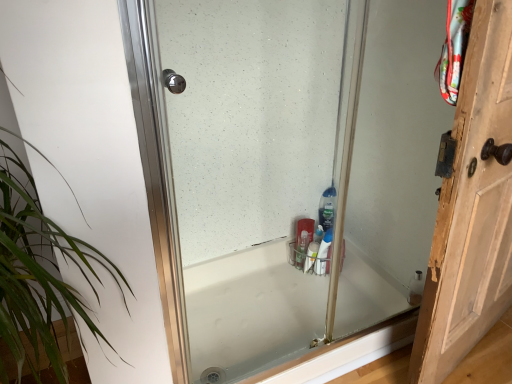
Where is `blank space to the left of white glossy bottle at lower right, the 2th cleaning product positioned from the top`? blank space to the left of white glossy bottle at lower right, the 2th cleaning product positioned from the top is located at coordinates (290, 280).